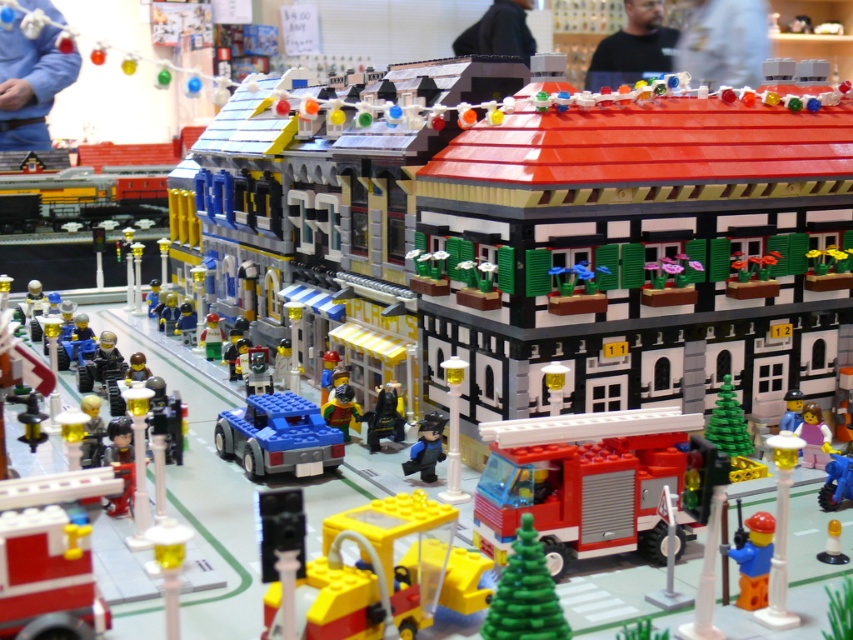
Does green matte christmas tree at center have a larger size compared to blue plastic minifigure at center?

Yes.

Is green matte christmas tree at center above blue plastic minifigure at center?

No, green matte christmas tree at center is not above blue plastic minifigure at center.

What are the coordinates of `green matte christmas tree at center` in the screenshot? It's located at (525, 593).

Can you confirm if yellow plastic truck at center is positioned to the left of blue plastic minifigure at center?

Indeed, yellow plastic truck at center is positioned on the left side of blue plastic minifigure at center.

Who is taller, yellow plastic truck at center or blue plastic minifigure at center?

yellow plastic truck at center

Locate an element on the screen. yellow plastic truck at center is located at coordinates (386, 572).

Which is more to the right, brick red fire truck at center or blue plastic minifigure at center?

blue plastic minifigure at center

Is brick red fire truck at center above blue plastic minifigure at center?

Incorrect, brick red fire truck at center is not positioned above blue plastic minifigure at center.

Locate an element on the screen. The image size is (853, 640). brick red fire truck at center is located at coordinates (581, 483).

Where is `brick red fire truck at center`? This screenshot has width=853, height=640. brick red fire truck at center is located at coordinates (581, 483).